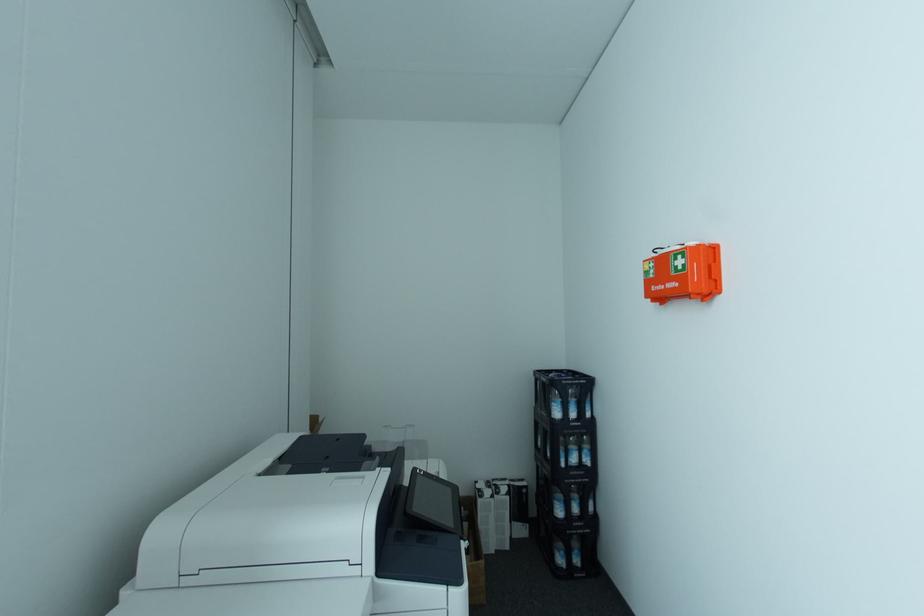
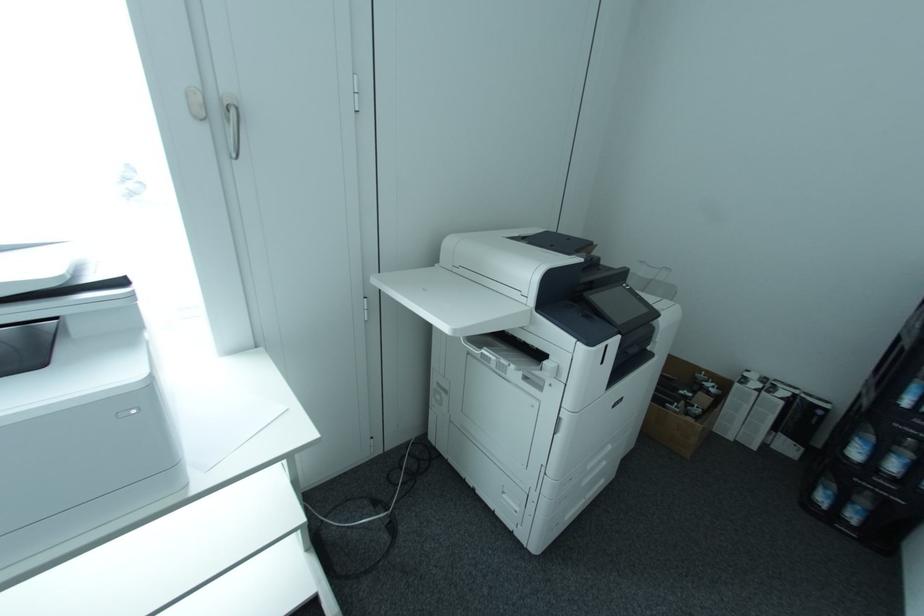
From the picture: The images are taken continuously from a first-person perspective. In which direction is your viewpoint rotating?

The camera rotated toward left-down.